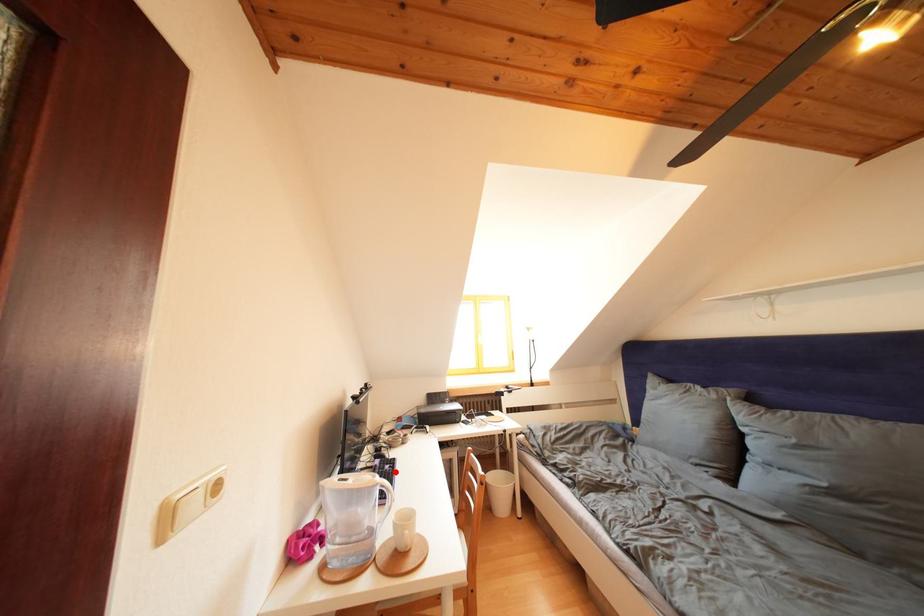
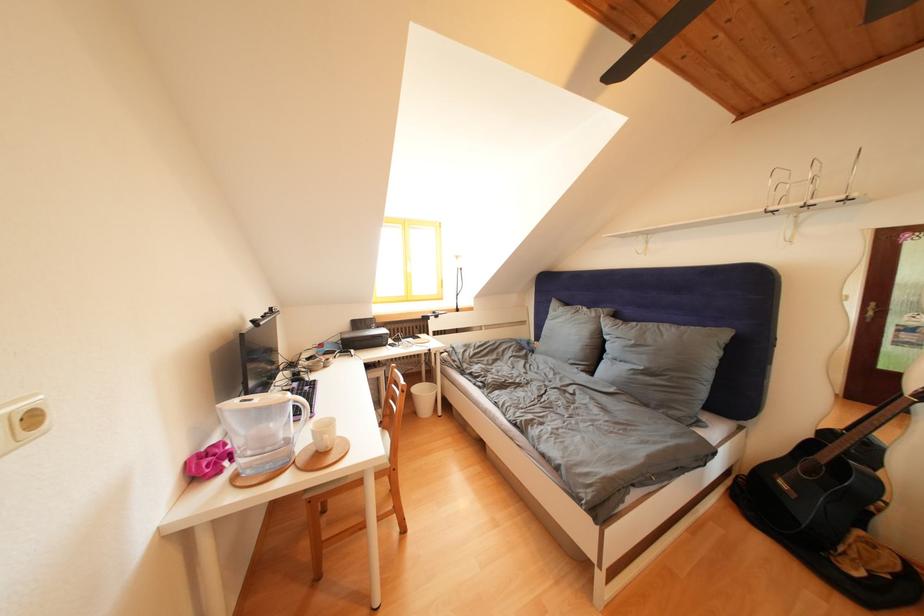
In the second image, find the point that corresponds to the highlighted location in the first image.

(314, 392)